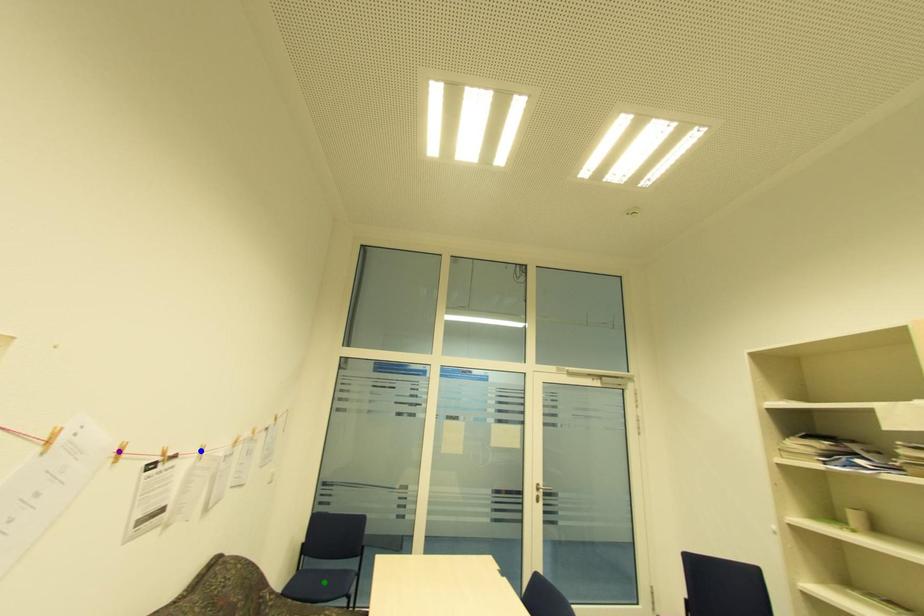
Order these from nearest to farthest:
1. blue point
2. green point
3. purple point

1. green point
2. blue point
3. purple point